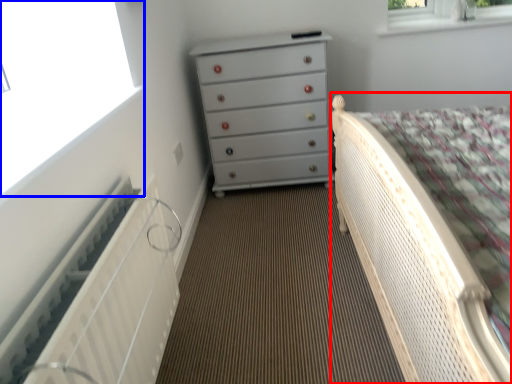
Question: Which object is closer to the camera taking this photo, bed (highlighted by a red box) or window (highlighted by a blue box)?

Choices:
 (A) bed
 (B) window

Answer: (A)